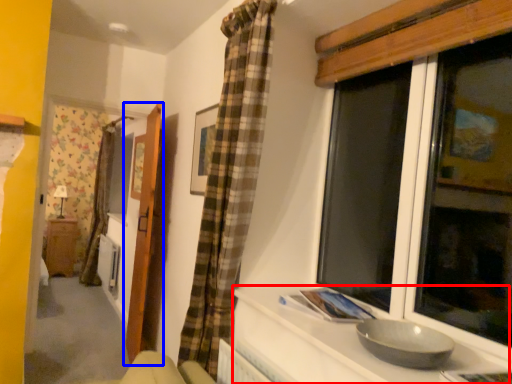
Question: Among these objects, which one is farthest to the camera, counter top (highlighted by a red box) or door (highlighted by a blue box)?

Choices:
 (A) counter top
 (B) door

Answer: (B)